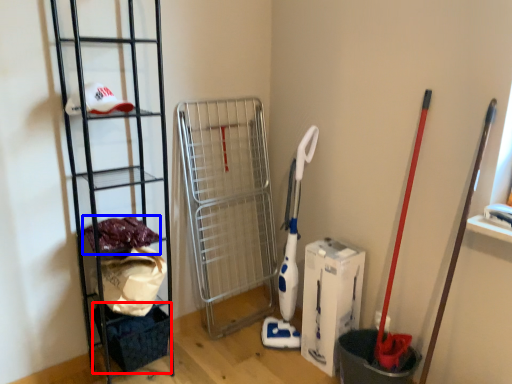
Question: Which object appears closest to the camera in this image, basket (highlighted by a red box) or material (highlighted by a blue box)?

Choices:
 (A) basket
 (B) material

Answer: (B)